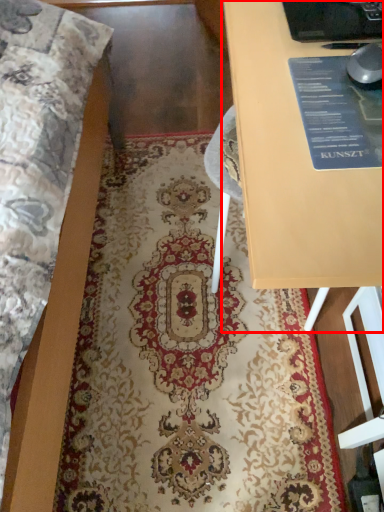
Question: From the image's perspective, what is the correct spatial positioning of table (annotated by the red box) in reference to mat?

Choices:
 (A) below
 (B) above

Answer: (B)